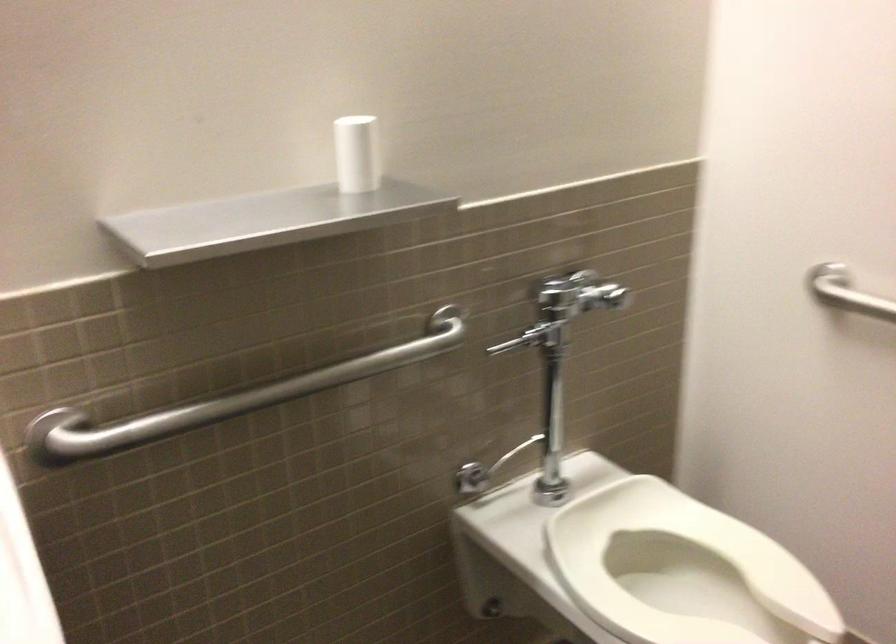
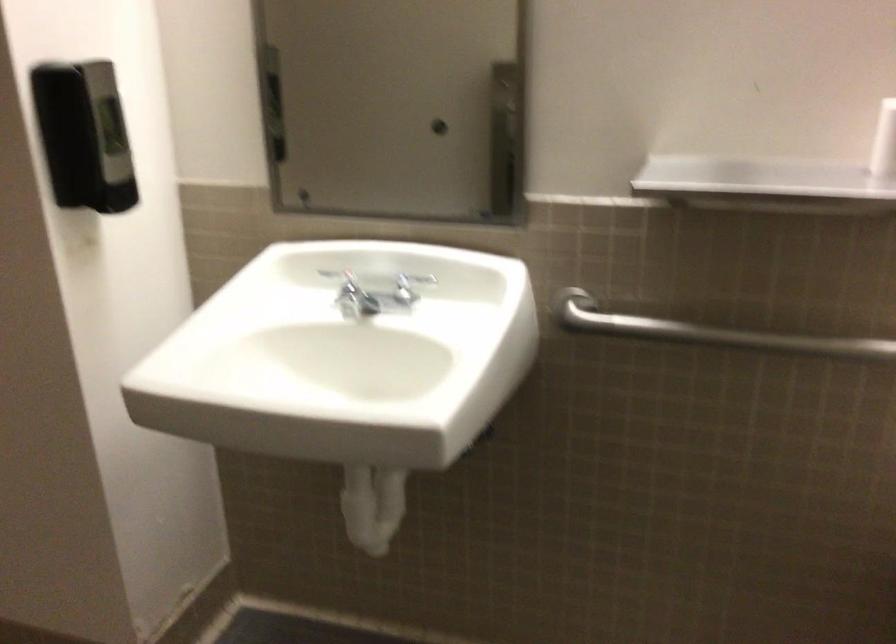
The point at (x=366, y=169) is marked in the first image. Where is the corresponding point in the second image?

(883, 142)